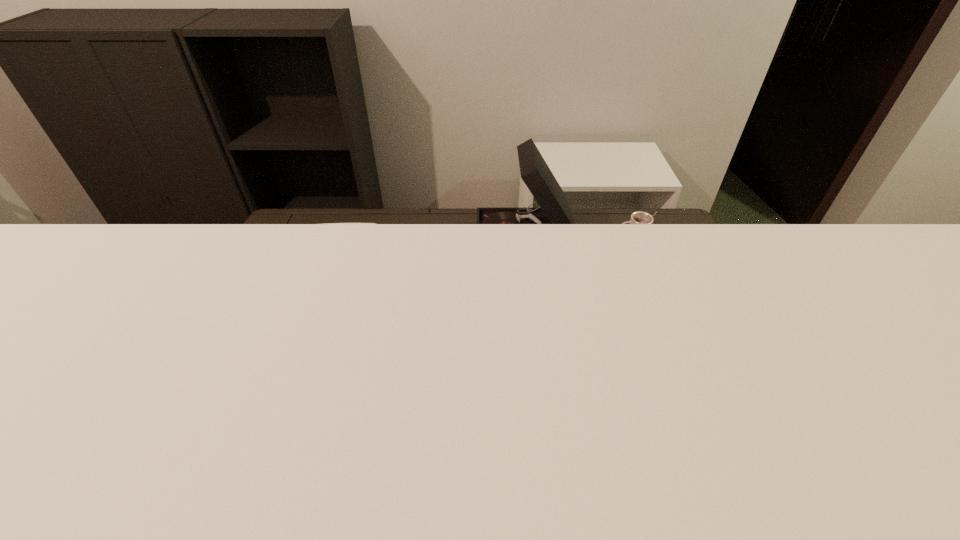
Find the location of a particular element. the second object from left to right is located at coordinates (555, 208).

You are a GUI agent. You are given a task and a screenshot of the screen. Output one action in this format:
    pyautogui.click(x=<x>, y=<y>)
    Task: Click on the phonograph_record
    
    Given the screenshot: What is the action you would take?
    pyautogui.click(x=555, y=208)

Find the location of `the leftmost object`. the leftmost object is located at coordinates (326, 223).

Find the location of a particular element. the second tallest object is located at coordinates tap(326, 223).

Locate an element on the screen. the rightmost object is located at coordinates (639, 217).

The height and width of the screenshot is (540, 960). Identify the location of cup. (639, 217).

What are the coordinates of `vacant space located 0.160m on the front-facing side of the phonograph_record` in the screenshot? It's located at (432, 243).

The width and height of the screenshot is (960, 540). Find the location of `free space located on the front-facing side of the phonograph_record`. free space located on the front-facing side of the phonograph_record is located at coordinates (365, 243).

I want to click on free space located 0.150m on the front-facing side of the phonograph_record, so click(435, 243).

You are a GUI agent. You are given a task and a screenshot of the screen. Output one action in this format:
    pyautogui.click(x=<x>, y=<y>)
    Task: Click on the vacant area located 0.280m on the front of the leftmost object
    
    Given the screenshot: What is the action you would take?
    pyautogui.click(x=286, y=465)